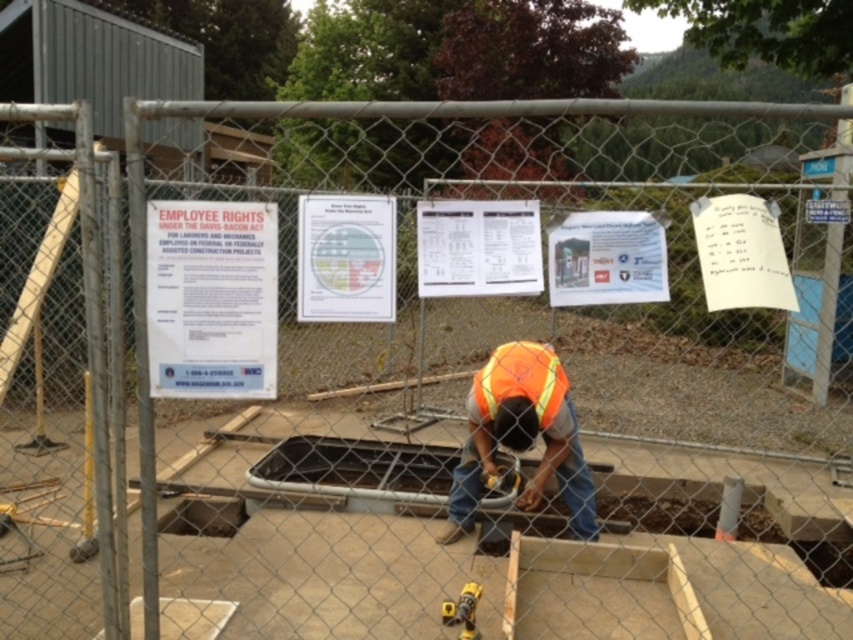
You are a safety inspector arriving at the construction site. You see the white paper sign at upper left and the orange reflective safety vest at center. Which object is positioned more to the left side of the scene?

The white paper sign at upper left is positioned more to the left side of the scene than the orange reflective safety vest at center.